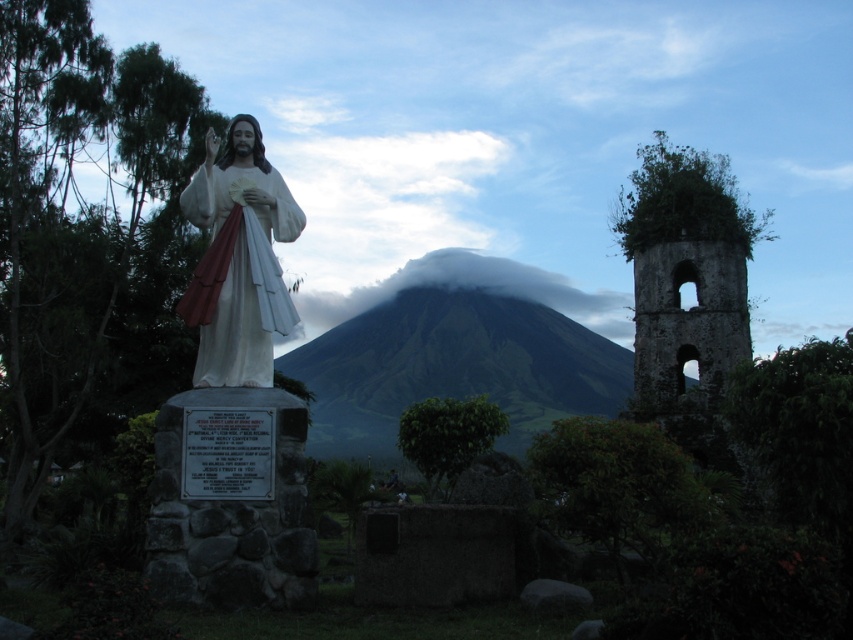
Is white glossy statue at center thinner than white fluffy cloud at center?

Yes, white glossy statue at center is thinner than white fluffy cloud at center.

Does white glossy statue at center have a greater width compared to white fluffy cloud at center?

No, white glossy statue at center is not wider than white fluffy cloud at center.

Which is in front, point (213, 371) or point (321, 307)?

Point (213, 371)

Image resolution: width=853 pixels, height=640 pixels. Find the location of `white glossy statue at center`. white glossy statue at center is located at coordinates (238, 259).

Between green grassy mountain at center and white glossy statue at center, which one has less height?

white glossy statue at center is shorter.

Which is below, green grassy mountain at center or white glossy statue at center?

green grassy mountain at center is below.

Where is `green grassy mountain at center`? green grassy mountain at center is located at coordinates (453, 368).

Based on the photo, is green grassy mountain at center to the right of white fluffy cloud at center from the viewer's perspective?

Correct, you'll find green grassy mountain at center to the right of white fluffy cloud at center.

Is point (376, 348) positioned in front of point (492, 273)?

Yes, it is in front of point (492, 273).

The image size is (853, 640). What are the coordinates of `green grassy mountain at center` in the screenshot? It's located at (453, 368).